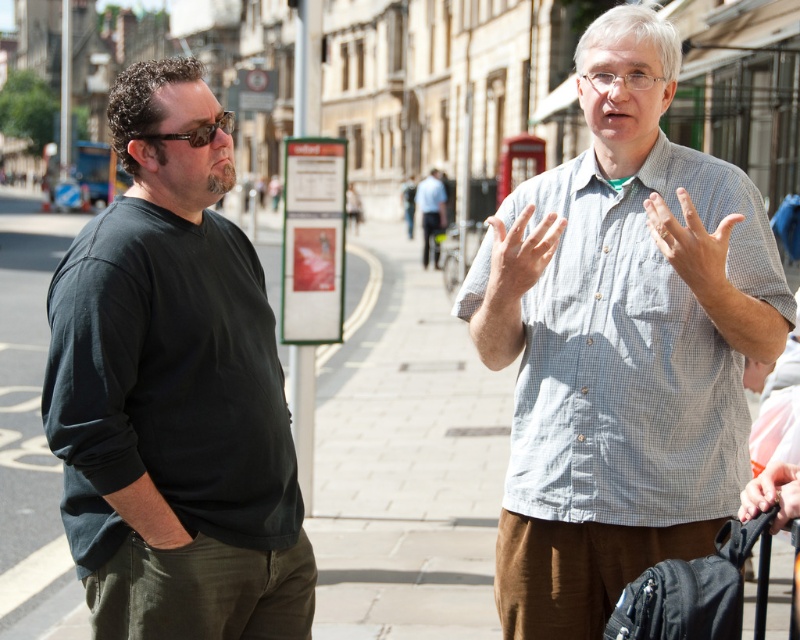
You are a photographer trying to capture a candid shot of the two men. You notice the white textured shirt at center and the smooth skin hand at lower right in your viewfinder. Which object should you focus on if you want to highlight the subject who is actively speaking?

The smooth skin hand at lower right should be focused on because it is positioned on the left side of the white textured shirt at center, indicating the speaker is the man on the right who is gesturing actively.

What are the coordinates of the paved stone sidewalk at center?

The paved stone sidewalk at center is located at coordinates point (408,465).